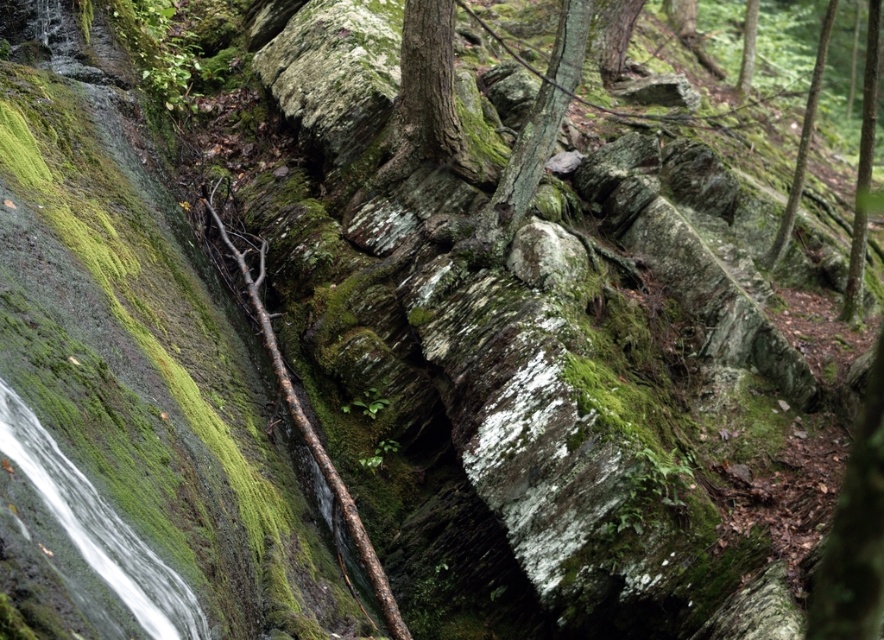
Question: Can you confirm if green mossy tree trunk at center is positioned to the left of green mossy tree at upper center?

Choices:
 (A) yes
 (B) no

Answer: (A)

Question: Which point is closer to the camera?

Choices:
 (A) green mossy tree trunk at center
 (B) smooth bark tree at center

Answer: (A)

Question: Among these objects, which one is farthest from the camera?

Choices:
 (A) green mossy tree at upper center
 (B) green mossy tree trunk at center

Answer: (A)

Question: Can you confirm if smooth bark tree at center is positioned to the right of green mossy tree at upper right?

Choices:
 (A) no
 (B) yes

Answer: (A)

Question: Is smooth bark tree at center in front of green mossy tree at upper center?

Choices:
 (A) yes
 (B) no

Answer: (A)

Question: Which point appears farthest from the camera in this image?

Choices:
 (A) (439, 115)
 (B) (865, 182)
 (C) (526, 209)
 (D) (743, 49)

Answer: (D)